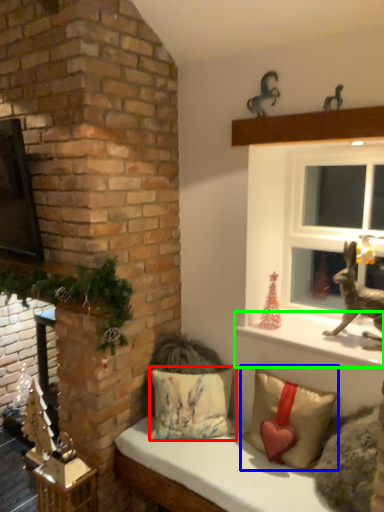
Question: Which object is the farthest from pillow (highlighted by a red box)? Choose among these: pillow (highlighted by a blue box) or window sill (highlighted by a green box).

Choices:
 (A) pillow
 (B) window sill

Answer: (B)